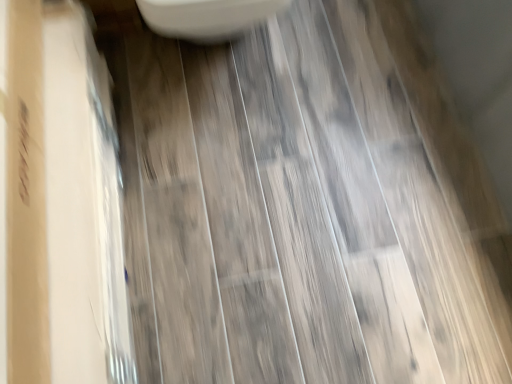
Where is `vacant point above matte white cardboard box at left (from a real-world perspective)`? This screenshot has width=512, height=384. vacant point above matte white cardboard box at left (from a real-world perspective) is located at coordinates (61, 157).